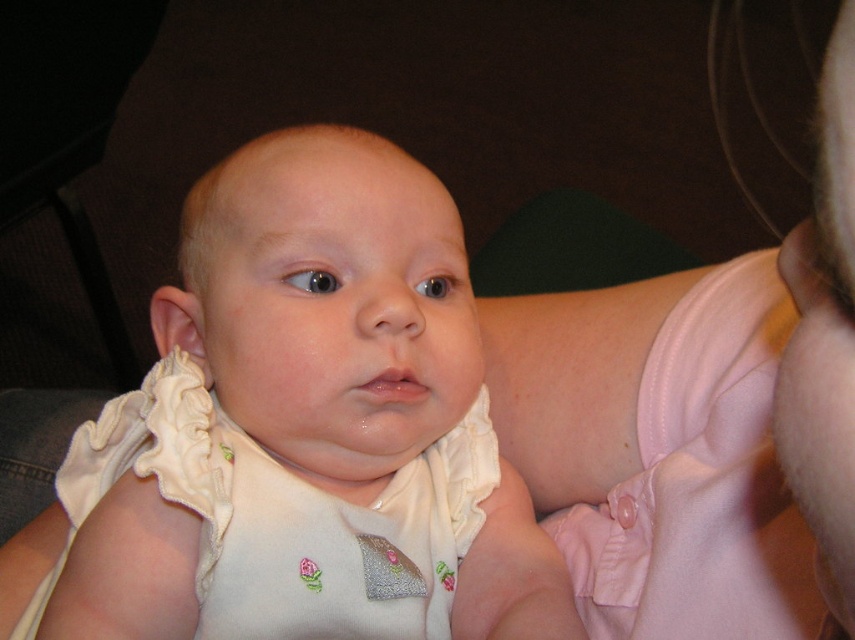
Does white soft fabric baby at center have a greater height compared to white ruffled bib at center?

Correct, white soft fabric baby at center is much taller as white ruffled bib at center.

How much distance is there between white soft fabric baby at center and white ruffled bib at center?

white soft fabric baby at center is 1.47 inches from white ruffled bib at center.

Where is `white soft fabric baby at center`? white soft fabric baby at center is located at coordinates (305, 428).

What are the coordinates of `white soft fabric baby at center` in the screenshot? It's located at (305, 428).